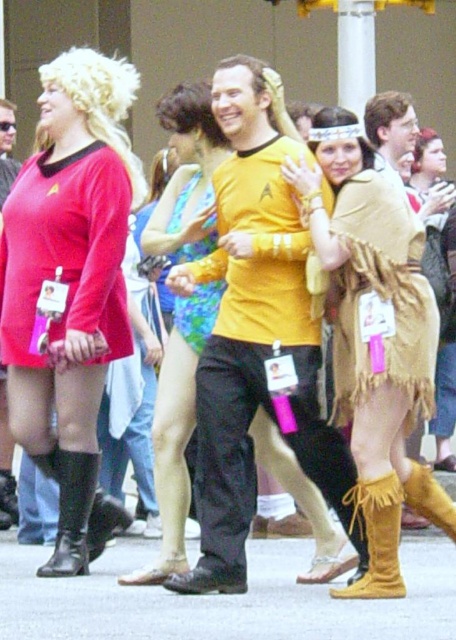
You are at a convention and need to locate two specific costumes. The first is the matte red uniform at left, and the second is the tan woven cape at center. If you are facing the scene, which costume would you encounter first as you move from left to right?

The matte red uniform at left is to the left of the tan woven cape at center, so you would encounter the matte red uniform at left first when moving from left to right.

What is the color of the dress located at the coordinates point (70,285)?

The point (70,285) corresponds to the matte red dress at center, so the dress there is red.

You are a photographer at this convention and need to capture a group photo of the matte red dress at center and the yellow matte shirt at center. The camera you are using has a maximum focus range of 15 feet. Can you fit both subjects into the frame without moving the camera?

The distance between the matte red dress at center and the yellow matte shirt at center is 17.54 feet, which exceeds the camera maximum focus range of 15 feet. Therefore, you cannot fit both subjects into the frame without moving the camera.